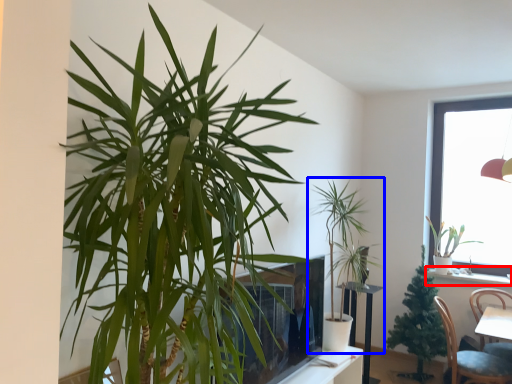
Question: Which point is closer to the camera, window sill (highlighted by a red box) or houseplant (highlighted by a blue box)?

Choices:
 (A) window sill
 (B) houseplant

Answer: (B)